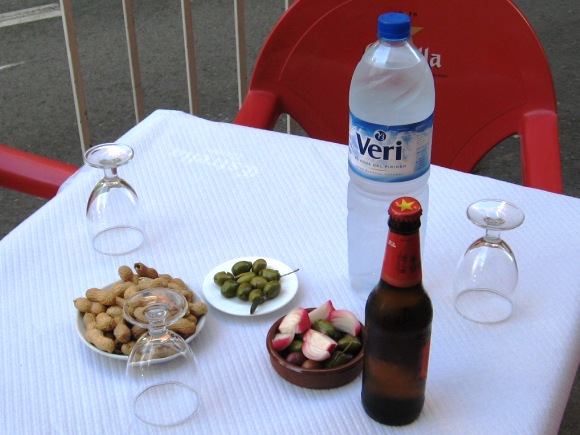
This screenshot has height=435, width=580. Identify the location of table cloth. (303, 190).